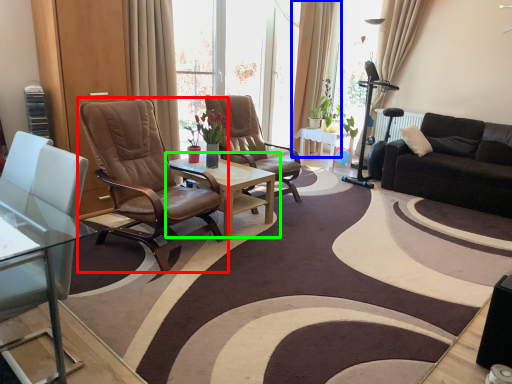
Question: Estimate the real-world distances between objects in this image. Which object is farther from chair (highlighted by a red box), curtain (highlighted by a blue box) or coffee table (highlighted by a green box)?

Choices:
 (A) curtain
 (B) coffee table

Answer: (A)